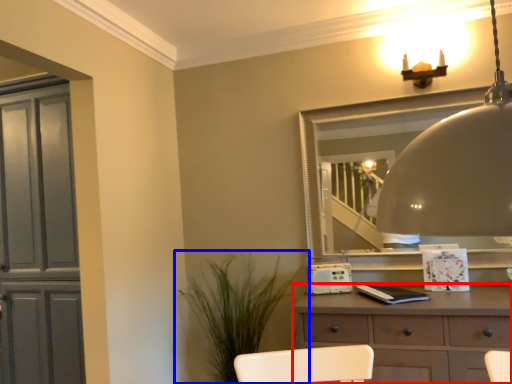
Question: Which object is closer to the camera taking this photo, chest of drawers (highlighted by a red box) or houseplant (highlighted by a blue box)?

Choices:
 (A) chest of drawers
 (B) houseplant

Answer: (A)